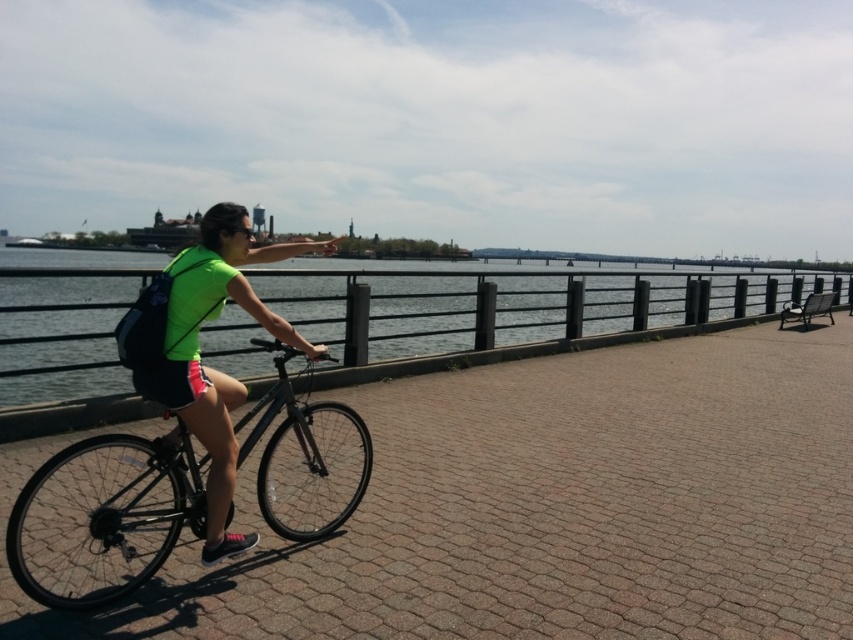
Question: Does shiny black bicycle at center appear under neon green fabric at center?

Choices:
 (A) no
 (B) yes

Answer: (B)

Question: Among these points, which one is nearest to the camera?

Choices:
 (A) (173, 408)
 (B) (10, 384)
 (C) (177, 416)

Answer: (A)

Question: Which is nearer to the shiny black bicycle at center?

Choices:
 (A) clear water at center
 (B) neon green fabric at center

Answer: (B)

Question: Is clear water at center to the left of neon green fabric at center from the viewer's perspective?

Choices:
 (A) yes
 (B) no

Answer: (A)

Question: Considering the relative positions of clear water at center and neon green fabric at center in the image provided, where is clear water at center located with respect to neon green fabric at center?

Choices:
 (A) above
 (B) below

Answer: (A)

Question: Which of the following is the farthest from the observer?

Choices:
 (A) (549, 323)
 (B) (225, 461)
 (C) (26, 573)

Answer: (A)